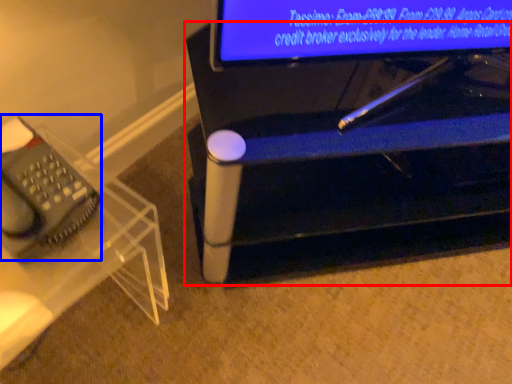
Question: Which object is further to the camera taking this photo, furniture (highlighted by a red box) or equipment (highlighted by a blue box)?

Choices:
 (A) furniture
 (B) equipment

Answer: (A)